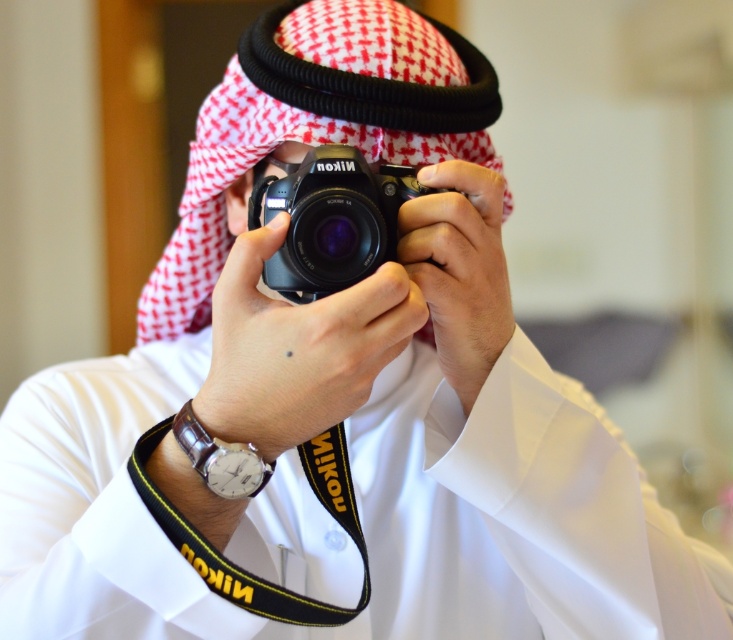
Does black matte nikon camera at center appear under leather watch at lower left?

Actually, black matte nikon camera at center is above leather watch at lower left.

Which is behind, point (397, 216) or point (237, 465)?

Point (397, 216)

Measure the distance between point (284,241) and camera.

Point (284,241) and camera are 56.36 centimeters apart.

Where is `black matte nikon camera at center`? black matte nikon camera at center is located at coordinates (331, 218).